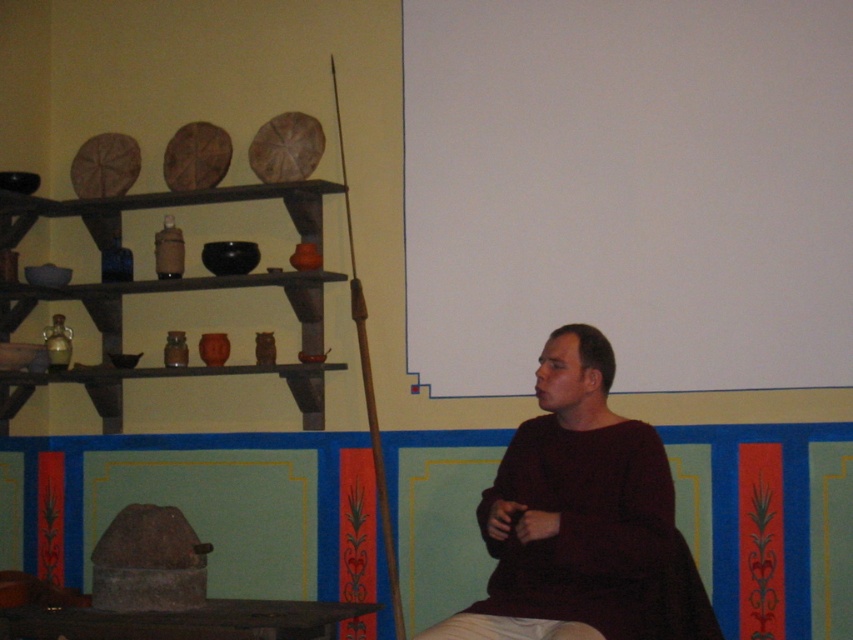
You are standing in front of the rustic indoor setting described. You notice two points marked in the scene. The first point is at coordinate (x=769, y=195) and the second at (x=10, y=243). From your perspective, which point is closer to you?

Point (x=769, y=195) is in front of point (x=10, y=243), so it is closer to you.

You are standing in front of the rustic indoor scene. There are two points marked in the image. The first point is at coordinate point (506, 504) and the second point is at coordinate point (4, 291). Which of these two points is closer to your viewpoint?

Point (506, 504) is closer to the camera than point (4, 291).